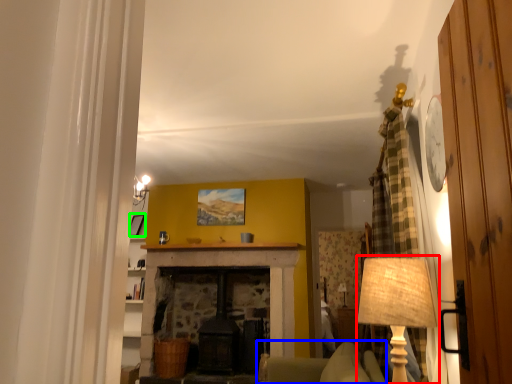
Question: Considering the real-world distances, which object is farthest from table lamp (highlighted by a red box)? armchair (highlighted by a blue box) or picture frame (highlighted by a green box)?

Choices:
 (A) armchair
 (B) picture frame

Answer: (A)